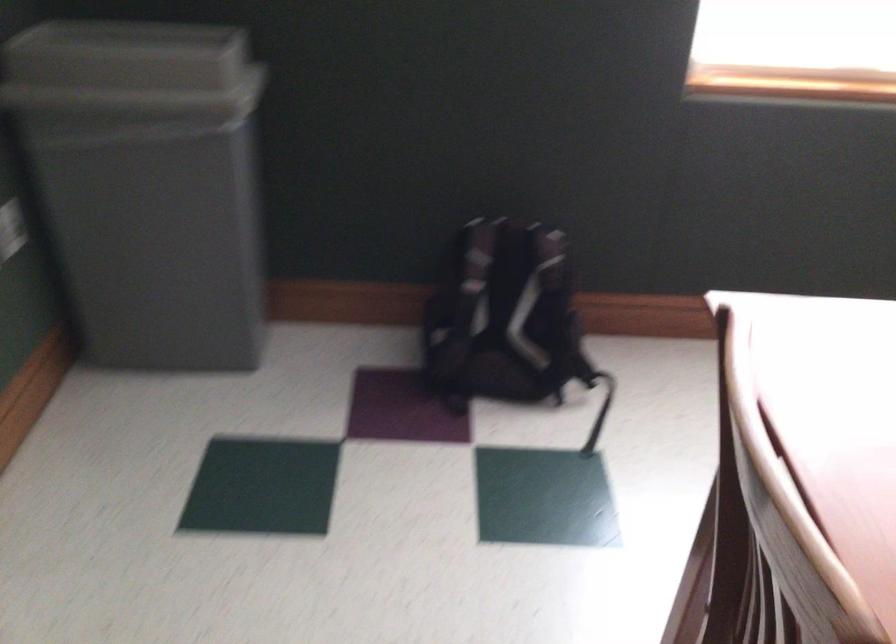
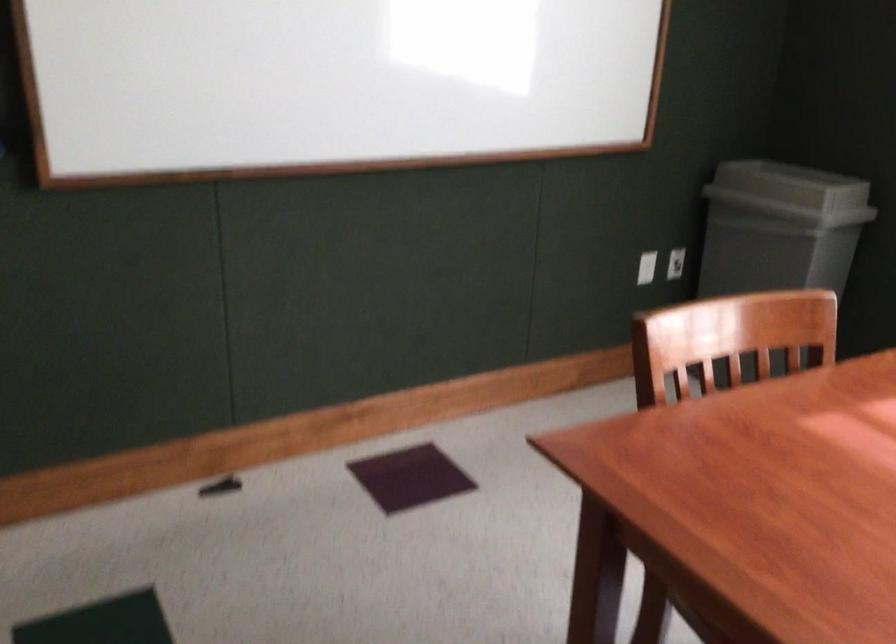
Locate, in the second image, the point that corresponds to the point at 192,71 in the first image.

(791, 185)